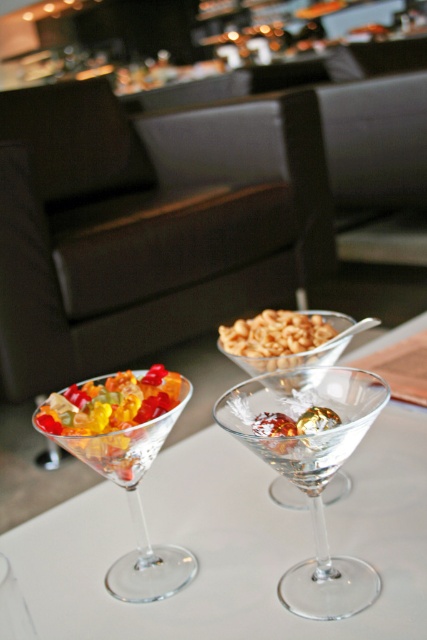
Which is more to the right, transparent glass table at center or translucent gelatinous candies at lower left?

From the viewer's perspective, transparent glass table at center appears more on the right side.

Consider the image. Between transparent glass table at center and translucent gelatinous candies at lower left, which one is positioned higher?

translucent gelatinous candies at lower left is above.

Does point (266, 484) come behind point (181, 396)?

Yes, it is.

You are a GUI agent. You are given a task and a screenshot of the screen. Output one action in this format:
    pyautogui.click(x=<x>, y=<y>)
    Task: Click on the transparent glass table at center
    This screenshot has width=427, height=640.
    Given the screenshot: What is the action you would take?
    pyautogui.click(x=233, y=541)

Is transparent glass at center thinner than translucent glass martini glass at lower left?

Yes.

Which is below, transparent glass at center or translucent glass martini glass at lower left?

translucent glass martini glass at lower left is below.

You are a GUI agent. You are given a task and a screenshot of the screen. Output one action in this format:
    pyautogui.click(x=<x>, y=<y>)
    Task: Click on the transparent glass at center
    This screenshot has width=427, height=640.
    Given the screenshot: What is the action you would take?
    pyautogui.click(x=310, y=467)

Where is `transparent glass at center`? Image resolution: width=427 pixels, height=640 pixels. transparent glass at center is located at coordinates (310, 467).

Which is in front, point (55, 435) or point (341, 342)?

Point (55, 435) is more forward.

Does point (70, 422) come closer to viewer compared to point (266, 364)?

Yes, point (70, 422) is in front of point (266, 364).

The image size is (427, 640). Describe the element at coordinates (114, 417) in the screenshot. I see `translucent gelatinous candies at lower left` at that location.

Where is `translucent gelatinous candies at lower left`? The width and height of the screenshot is (427, 640). translucent gelatinous candies at lower left is located at coordinates (114, 417).